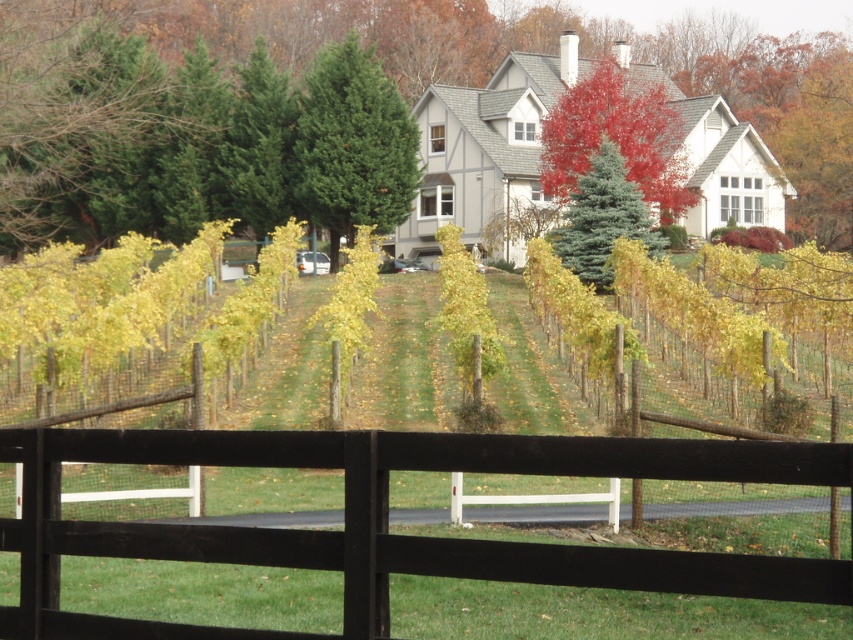
Question: Is green matte evergreen tree at upper left positioned in front of green leafy tree at center?

Choices:
 (A) yes
 (B) no

Answer: (B)

Question: Among these objects, which one is farthest from the camera?

Choices:
 (A) green matte evergreen tree at upper left
 (B) green textured tree at center
 (C) green leafy tree at upper center

Answer: (B)

Question: Which of the following is the farthest from the observer?

Choices:
 (A) (488, 355)
 (B) (86, 410)

Answer: (A)

Question: Can you confirm if green leafy tree at upper center is thinner than green leafy tree at center?

Choices:
 (A) no
 (B) yes

Answer: (A)

Question: Can you confirm if green textured tree at center is bigger than green leafy tree at center?

Choices:
 (A) no
 (B) yes

Answer: (B)

Question: Which of these objects is positioned farthest from the black wood fence at center?

Choices:
 (A) green leafy tree at upper center
 (B) blue-green fir tree at center-right
 (C) red glossy tree at upper center
 (D) green textured tree at center

Answer: (A)